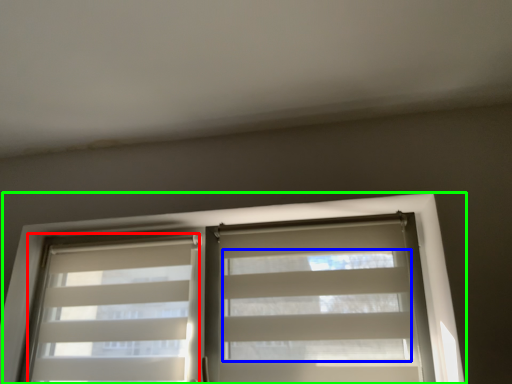
Question: Estimate the real-world distances between objects in this image. Which object is farther from shutter (highlighted by a red box), blind (highlighted by a blue box) or window (highlighted by a green box)?

Choices:
 (A) blind
 (B) window

Answer: (A)